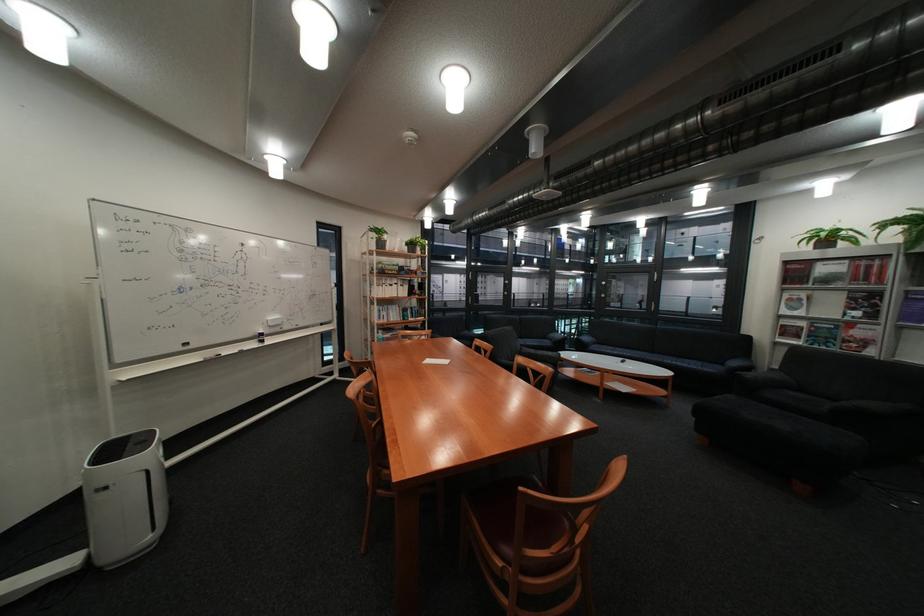
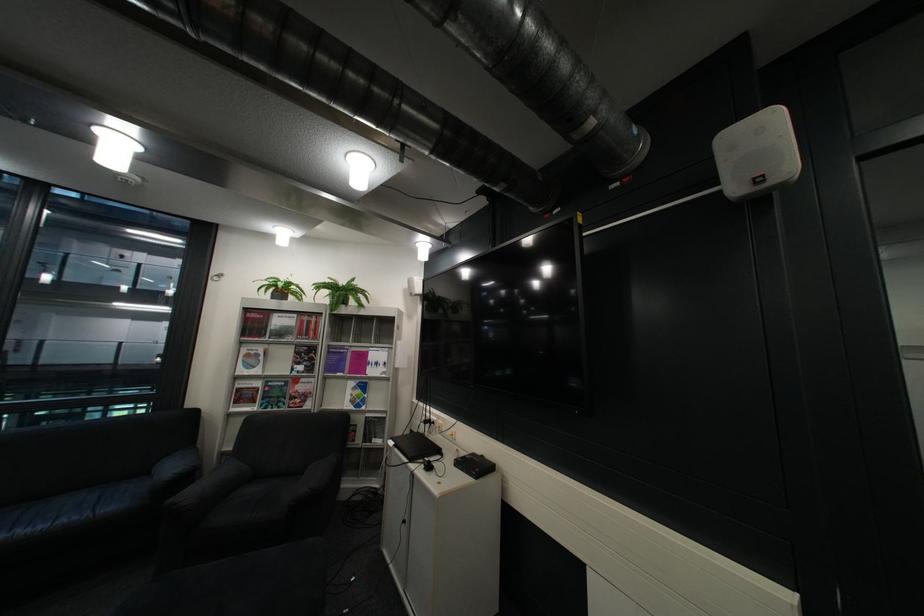
In the second image, find the point that corresponds to [763,375] in the first image.

(204, 495)